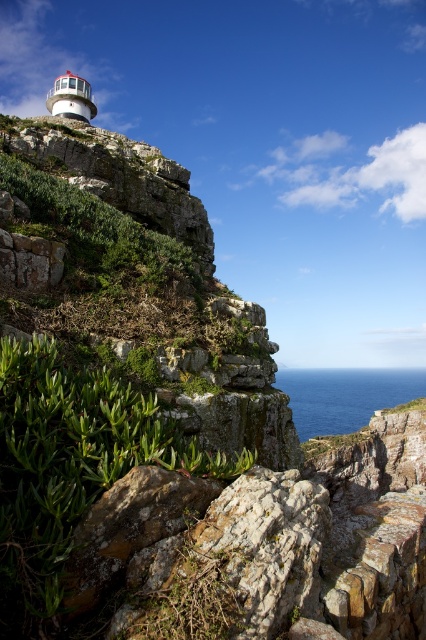
Which is more to the left, green leafy plant at center or blue water at lower center?

From the viewer's perspective, green leafy plant at center appears more on the left side.

Which is more to the right, green leafy plant at center or blue water at lower center?

blue water at lower center is more to the right.

Who is more distant from viewer, (54, 356) or (368, 394)?

The point (368, 394) is behind.

The image size is (426, 640). What are the coordinates of `green leafy plant at center` in the screenshot? It's located at (71, 465).